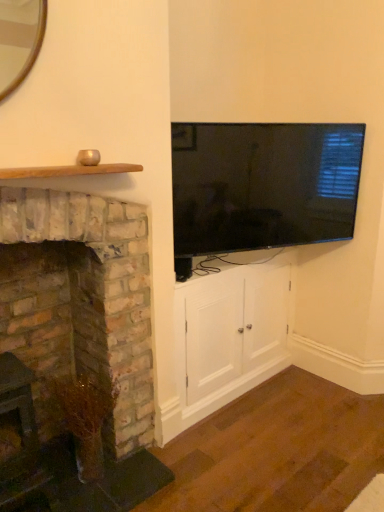
Question: Are white wood cabinet at center and brick fireplace at left far apart?

Choices:
 (A) yes
 (B) no

Answer: (B)

Question: Can you confirm if white wood cabinet at center is positioned to the left of brick fireplace at left?

Choices:
 (A) no
 (B) yes

Answer: (A)

Question: Considering the relative positions of white wood cabinet at center and brick fireplace at left in the image provided, is white wood cabinet at center in front of brick fireplace at left?

Choices:
 (A) yes
 (B) no

Answer: (B)

Question: Is brick fireplace at left located within white wood cabinet at center?

Choices:
 (A) yes
 (B) no

Answer: (B)

Question: Does white wood cabinet at center have a lesser height compared to brick fireplace at left?

Choices:
 (A) no
 (B) yes

Answer: (B)

Question: Is white wood cabinet at center positioned behind brick fireplace at left?

Choices:
 (A) yes
 (B) no

Answer: (A)

Question: Does flat-screen tv at upper right turn towards brick fireplace at left?

Choices:
 (A) yes
 (B) no

Answer: (B)

Question: Is flat-screen tv at upper right at the left side of brick fireplace at left?

Choices:
 (A) no
 (B) yes

Answer: (A)

Question: From a real-world perspective, is flat-screen tv at upper right under brick fireplace at left?

Choices:
 (A) no
 (B) yes

Answer: (A)

Question: Is flat-screen tv at upper right bigger than brick fireplace at left?

Choices:
 (A) yes
 (B) no

Answer: (B)

Question: Is brick fireplace at left surrounded by flat-screen tv at upper right?

Choices:
 (A) no
 (B) yes

Answer: (A)

Question: Is flat-screen tv at upper right completely or partially outside of brick fireplace at left?

Choices:
 (A) yes
 (B) no

Answer: (A)

Question: From the image's perspective, is brick fireplace at left under white wood cabinet at center?

Choices:
 (A) yes
 (B) no

Answer: (B)